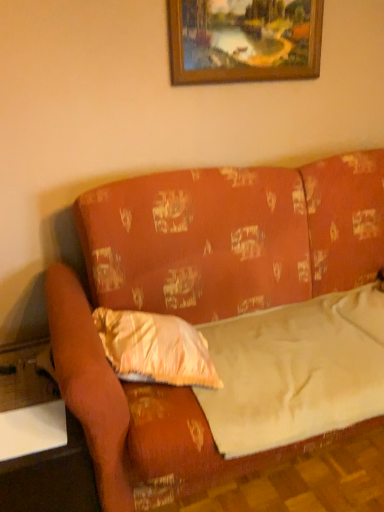
Question: Considering the relative positions of white fabric sheet at center and wooden glossy table at lower left, positioned as the second table in top-to-bottom order, in the image provided, is white fabric sheet at center to the left of wooden glossy table at lower left, positioned as the second table in top-to-bottom order, from the viewer's perspective?

Choices:
 (A) no
 (B) yes

Answer: (A)

Question: Does white fabric sheet at center appear on the right side of wooden glossy table at lower left, positioned as the second table in top-to-bottom order?

Choices:
 (A) no
 (B) yes

Answer: (B)

Question: Does white fabric sheet at center have a greater width compared to wooden glossy table at lower left, the first table in the bottom-to-top sequence?

Choices:
 (A) no
 (B) yes

Answer: (A)

Question: From the image's perspective, would you say white fabric sheet at center is positioned over wooden glossy table at lower left, positioned as the second table in top-to-bottom order?

Choices:
 (A) no
 (B) yes

Answer: (B)

Question: Is white fabric sheet at center positioned before wooden glossy table at lower left, the first table in the bottom-to-top sequence?

Choices:
 (A) no
 (B) yes

Answer: (B)

Question: Does white fabric sheet at center have a greater height compared to wooden glossy table at lower left, positioned as the second table in top-to-bottom order?

Choices:
 (A) no
 (B) yes

Answer: (A)

Question: From the image's perspective, is shiny gold pillow at center-left on orange fabric couch at center?

Choices:
 (A) no
 (B) yes

Answer: (A)

Question: Does shiny gold pillow at center-left turn towards orange fabric couch at center?

Choices:
 (A) yes
 (B) no

Answer: (A)

Question: From a real-world perspective, is shiny gold pillow at center-left positioned over orange fabric couch at center based on gravity?

Choices:
 (A) yes
 (B) no

Answer: (B)

Question: Is shiny gold pillow at center-left closer to camera compared to orange fabric couch at center?

Choices:
 (A) yes
 (B) no

Answer: (B)

Question: Is shiny gold pillow at center-left taller than orange fabric couch at center?

Choices:
 (A) yes
 (B) no

Answer: (B)

Question: Does shiny gold pillow at center-left have a lesser width compared to orange fabric couch at center?

Choices:
 (A) yes
 (B) no

Answer: (A)

Question: From a real-world perspective, is white fabric sheet at center positioned over white plastic table at lower left, arranged as the 2th table when ordered from the bottom, based on gravity?

Choices:
 (A) yes
 (B) no

Answer: (A)